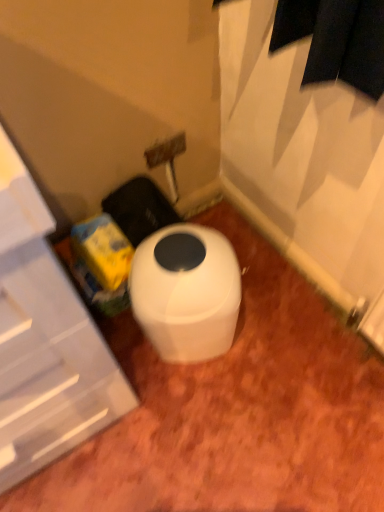
What do you see at coordinates (186, 292) in the screenshot? The height and width of the screenshot is (512, 384). I see `white glossy toilet at center` at bounding box center [186, 292].

This screenshot has width=384, height=512. I want to click on white glossy toilet at center, so click(186, 292).

This screenshot has height=512, width=384. Describe the element at coordinates (45, 340) in the screenshot. I see `white plastic cabinet at left` at that location.

Where is `white plastic cabinet at left`? white plastic cabinet at left is located at coordinates (45, 340).

Where is `white glossy toilet at center`? This screenshot has width=384, height=512. white glossy toilet at center is located at coordinates (186, 292).

Between white plastic cabinet at left and white glossy toilet at center, which one appears on the left side from the viewer's perspective?

From the viewer's perspective, white plastic cabinet at left appears more on the left side.

In the image, is white plastic cabinet at left positioned in front of or behind white glossy toilet at center?

white plastic cabinet at left is positioned closer to the viewer than white glossy toilet at center.

Does point (11, 204) come in front of point (165, 325)?

Yes.

From the image's perspective, which is below, white plastic cabinet at left or white glossy toilet at center?

white glossy toilet at center.

From a real-world perspective, does white plastic cabinet at left sit lower than white glossy toilet at center?

Actually, white plastic cabinet at left is physically above white glossy toilet at center in the real world.

Which of these two, white plastic cabinet at left or white glossy toilet at center, is wider?

With larger width is white plastic cabinet at left.

Is white plastic cabinet at left shorter than white glossy toilet at center?

No, white plastic cabinet at left is not shorter than white glossy toilet at center.

Looking at the image, does white plastic cabinet at left seem bigger or smaller compared to white glossy toilet at center?

Considering their sizes, white plastic cabinet at left takes up more space than white glossy toilet at center.

In the scene shown: Is white glossy toilet at center surrounded by white plastic cabinet at left?

No, white glossy toilet at center is not inside white plastic cabinet at left.

Are white plastic cabinet at left and white glossy toilet at center beside each other?

No, white plastic cabinet at left is not in contact with white glossy toilet at center.

Is white plastic cabinet at left turned away from white glossy toilet at center?

white plastic cabinet at left is not turned away from white glossy toilet at center.

How far apart are white plastic cabinet at left and white glossy toilet at center?

white plastic cabinet at left and white glossy toilet at center are 26.96 centimeters apart.

The image size is (384, 512). There is a white glossy toilet at center. Identify the location of cabinetry above it (from a real-world perspective). (45, 340).

Considering the relative positions of white glossy toilet at center and white plastic cabinet at left in the image provided, is white glossy toilet at center to the right of white plastic cabinet at left from the viewer's perspective?

Correct, you'll find white glossy toilet at center to the right of white plastic cabinet at left.

Which object is further away from the camera, white glossy toilet at center or white plastic cabinet at left?

white glossy toilet at center.

Between point (139, 323) and point (39, 458), which one is positioned behind?

Point (139, 323)

From the image's perspective, which is below, white glossy toilet at center or white plastic cabinet at left?

white glossy toilet at center is shown below in the image.

From a real-world perspective, is white glossy toilet at center above or below white plastic cabinet at left?

From a real-world perspective, white glossy toilet at center is physically below white plastic cabinet at left.

Considering the sizes of white glossy toilet at center and white plastic cabinet at left in the image, is white glossy toilet at center wider or thinner than white plastic cabinet at left?

Clearly, white glossy toilet at center has less width compared to white plastic cabinet at left.

Considering the sizes of objects white glossy toilet at center and white plastic cabinet at left in the image provided, who is taller, white glossy toilet at center or white plastic cabinet at left?

Standing taller between the two is white plastic cabinet at left.

In the scene shown: In terms of size, does white glossy toilet at center appear bigger or smaller than white plastic cabinet at left?

white glossy toilet at center is smaller than white plastic cabinet at left.

Is white plastic cabinet at left completely or partially inside white glossy toilet at center?

No, white plastic cabinet at left is located outside of white glossy toilet at center.

Is white glossy toilet at center in contact with white plastic cabinet at left?

No, white glossy toilet at center is not touching white plastic cabinet at left.

Is white plastic cabinet at left at the back of white glossy toilet at center?

white glossy toilet at center does not have its back to white plastic cabinet at left.

Identify the location of cabinetry that appears above the white glossy toilet at center (from the image's perspective). (45, 340).

In the image, there is a white plastic cabinet at left. Identify the location of toilet below it (from the image's perspective). The width and height of the screenshot is (384, 512). (186, 292).

Locate an element on the screen. cabinetry located above the white glossy toilet at center (from the image's perspective) is located at coordinates (45, 340).